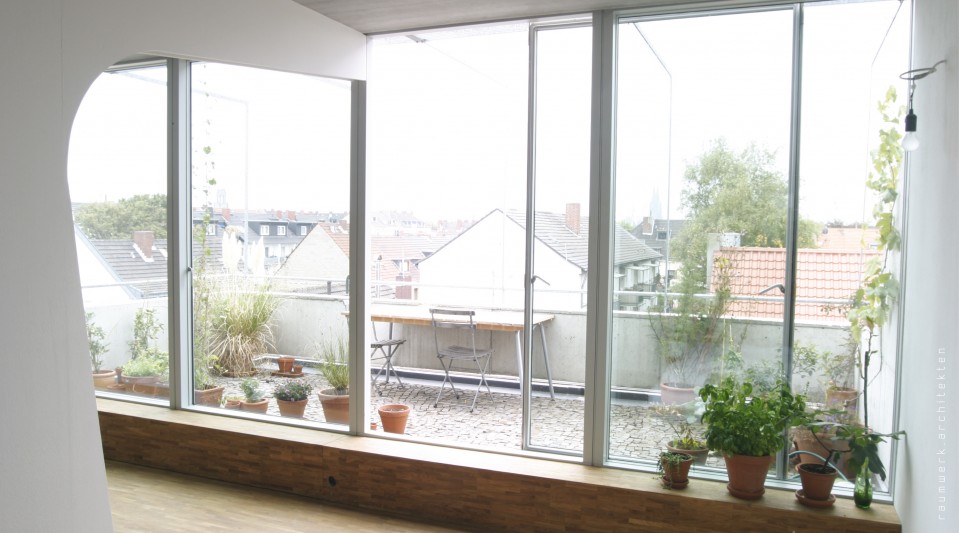
Locate an element on the screen. This screenshot has width=959, height=533. chimney is located at coordinates (153, 251), (353, 230), (567, 221), (741, 244).